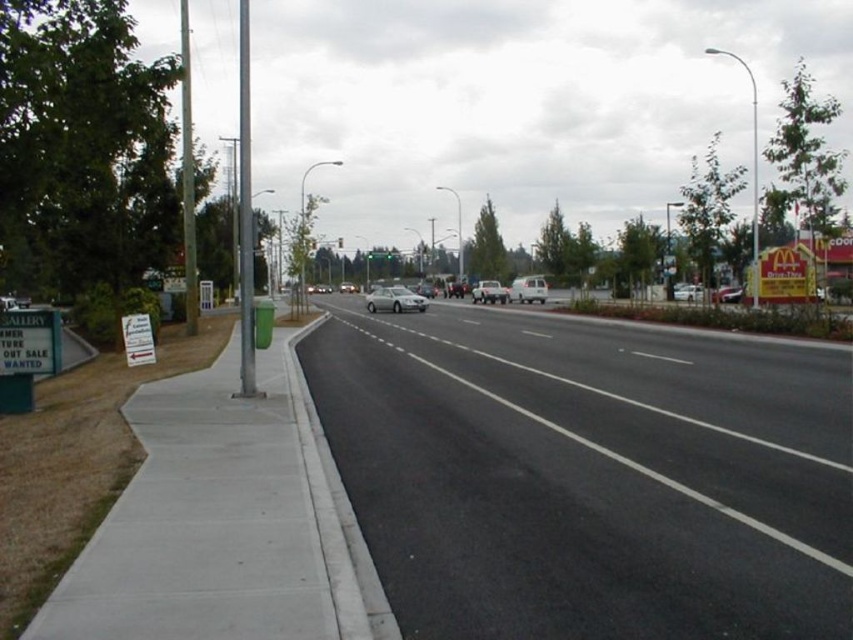
Between point (767, 547) and point (541, 285), which one is positioned in front?

Point (767, 547) is more forward.

Is point (643, 387) positioned before point (532, 291)?

Yes, it is.

You are a GUI agent. You are given a task and a screenshot of the screen. Output one action in this format:
    pyautogui.click(x=<x>, y=<y>)
    Task: Click on the black asphalt highway at center
    This screenshot has width=853, height=640.
    Given the screenshot: What is the action you would take?
    pyautogui.click(x=585, y=477)

Locate an element on the screen. black asphalt highway at center is located at coordinates (585, 477).

Is point (320, 436) positioned in front of point (27, 340)?

Yes, it is.

Based on the photo, which of these two, gray concrete curb at lower left or white paper sign at lower left, stands shorter?

With less height is gray concrete curb at lower left.

Who is more forward, (397, 634) or (51, 316)?

Point (397, 634) is in front.

Find the location of a particular element. gray concrete curb at lower left is located at coordinates (340, 499).

Is black asphalt highway at center in front of metallic pole at left?

Yes, it is in front of metallic pole at left.

You are a GUI agent. You are given a task and a screenshot of the screen. Output one action in this format:
    pyautogui.click(x=<x>, y=<y>)
    Task: Click on the black asphalt highway at center
    
    Given the screenshot: What is the action you would take?
    pyautogui.click(x=585, y=477)

Where is `black asphalt highway at center`? This screenshot has width=853, height=640. black asphalt highway at center is located at coordinates (585, 477).